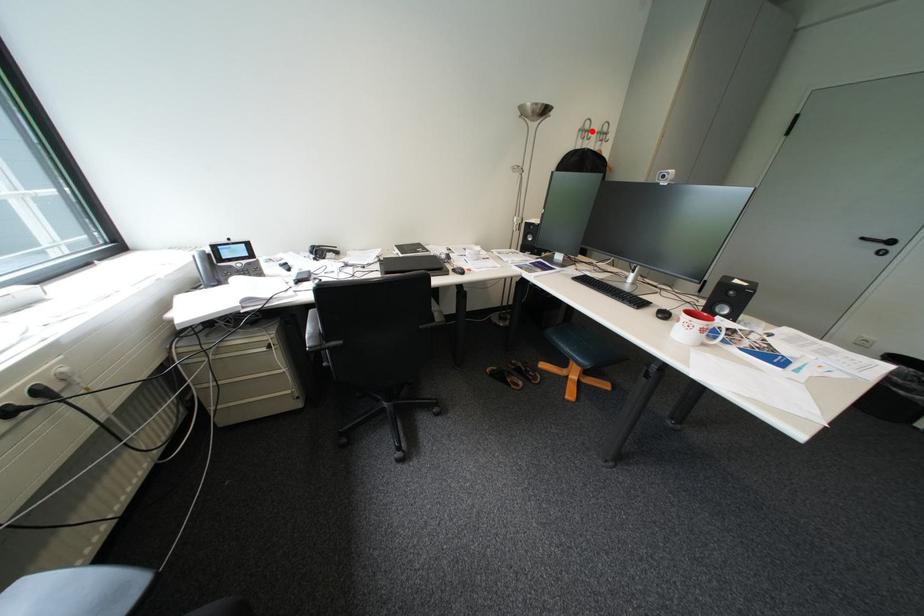
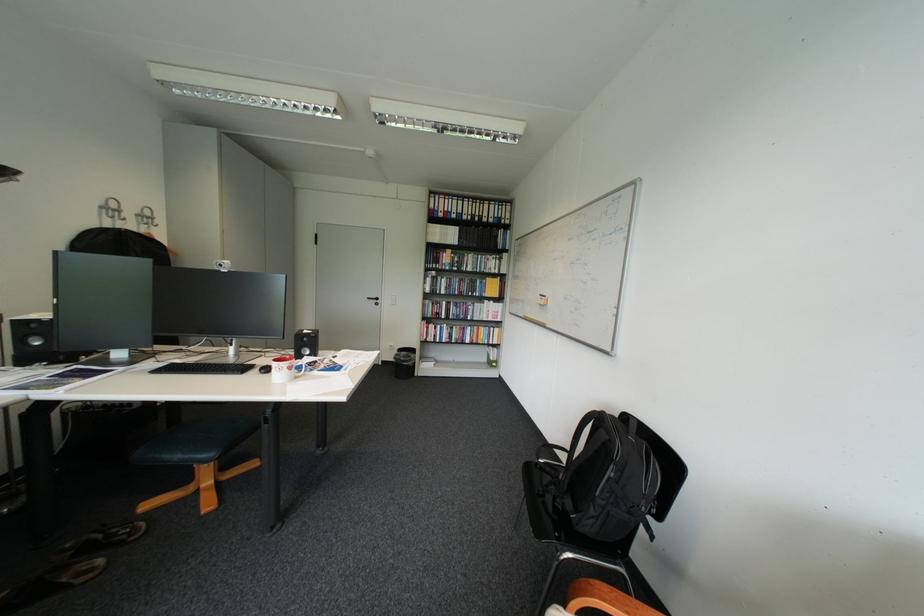
The point at the highlighted location is marked in the first image. Where is the corresponding point in the second image?

(114, 208)